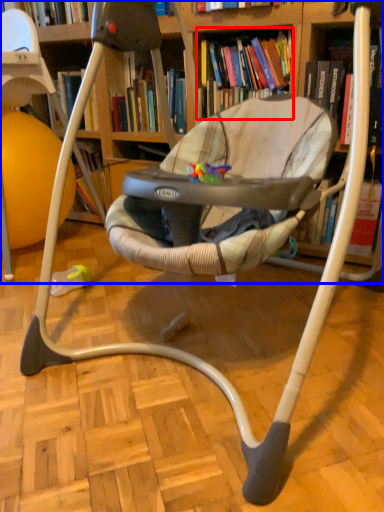
Question: Which of the following is the closest to the observer, book (highlighted by a red box) or bookcase (highlighted by a blue box)?

Choices:
 (A) book
 (B) bookcase

Answer: (B)